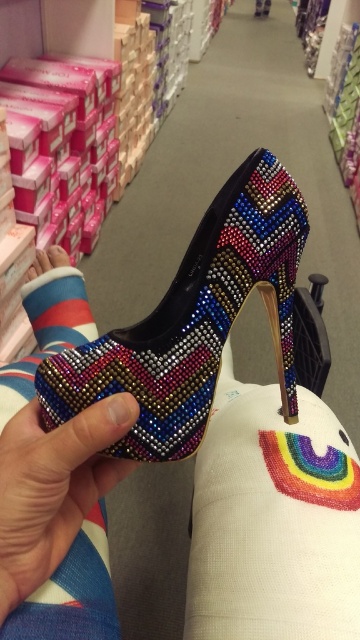
Question: Does multicolored beaded shoe at center appear over striped cotton sock at lower left?

Choices:
 (A) no
 (B) yes

Answer: (A)

Question: Observing the image, what is the correct spatial positioning of multicolored beaded shoe at center in reference to striped cotton sock at lower left?

Choices:
 (A) below
 (B) above

Answer: (A)

Question: Is multicolored beaded shoe at center further to camera compared to striped cotton sock at lower left?

Choices:
 (A) no
 (B) yes

Answer: (A)

Question: Which point is farther to the camera?

Choices:
 (A) multicolored beaded shoe at center
 (B) striped cotton sock at lower left

Answer: (B)

Question: Among these objects, which one is farthest from the camera?

Choices:
 (A) multicolored beaded shoe at center
 (B) striped cotton sock at lower left

Answer: (B)